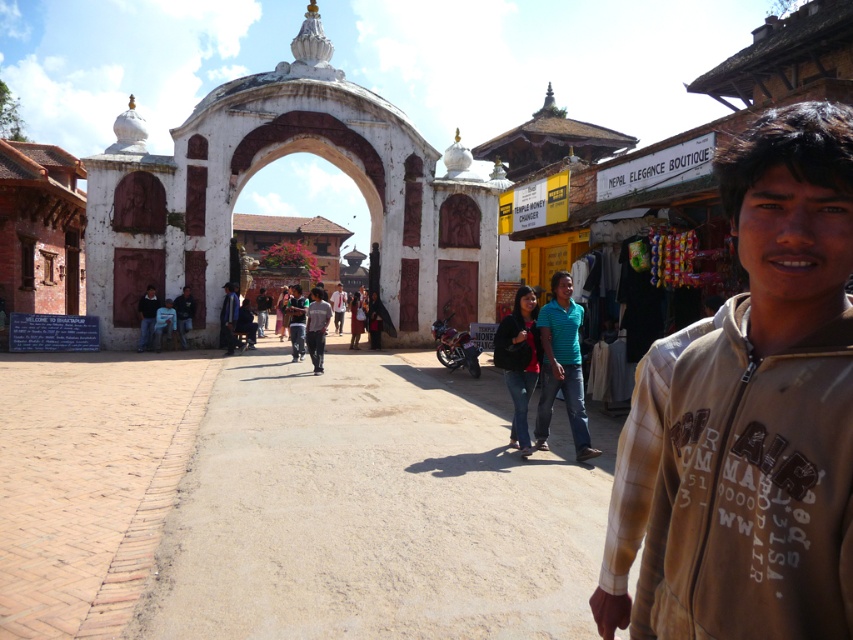
Question: Can you confirm if teal striped shirt at center is thinner than dark brown leather jacket at center?

Choices:
 (A) no
 (B) yes

Answer: (B)

Question: Among these points, which one is farthest from the camera?

Choices:
 (A) (552, 358)
 (B) (231, 326)
 (C) (532, 374)
 (D) (337, 333)

Answer: (D)

Question: Does teal striped shirt at center appear on the right side of dark brown leather jacket at lower left?

Choices:
 (A) yes
 (B) no

Answer: (A)

Question: Which point is farther to the camera?

Choices:
 (A) matte black jacket at center
 (B) dark gray shirt at center

Answer: (B)

Question: Does teal striped shirt at center lie behind dark gray shirt at center?

Choices:
 (A) yes
 (B) no

Answer: (B)

Question: Which object is positioned farthest from the teal striped shirt at center?

Choices:
 (A) dark brown leather jacket at center
 (B) dark gray shirt at center

Answer: (A)